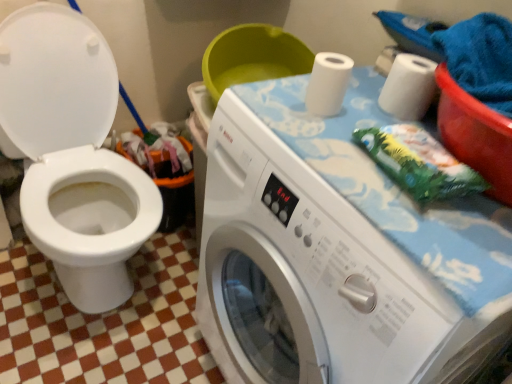
Where is `free space that is to the left of green fabric at upper right`? free space that is to the left of green fabric at upper right is located at coordinates (322, 150).